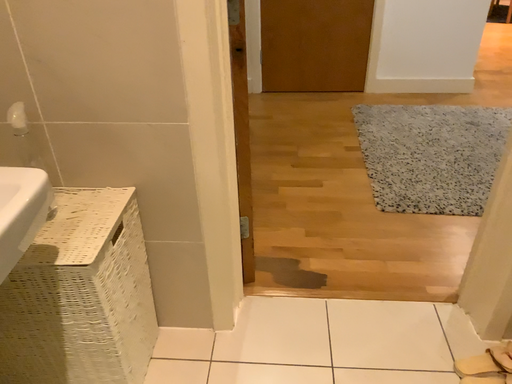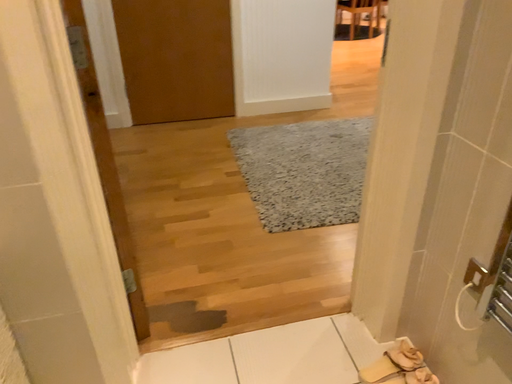
Question: How did the camera likely rotate when shooting the video?

Choices:
 (A) rotated left
 (B) rotated right

Answer: (B)